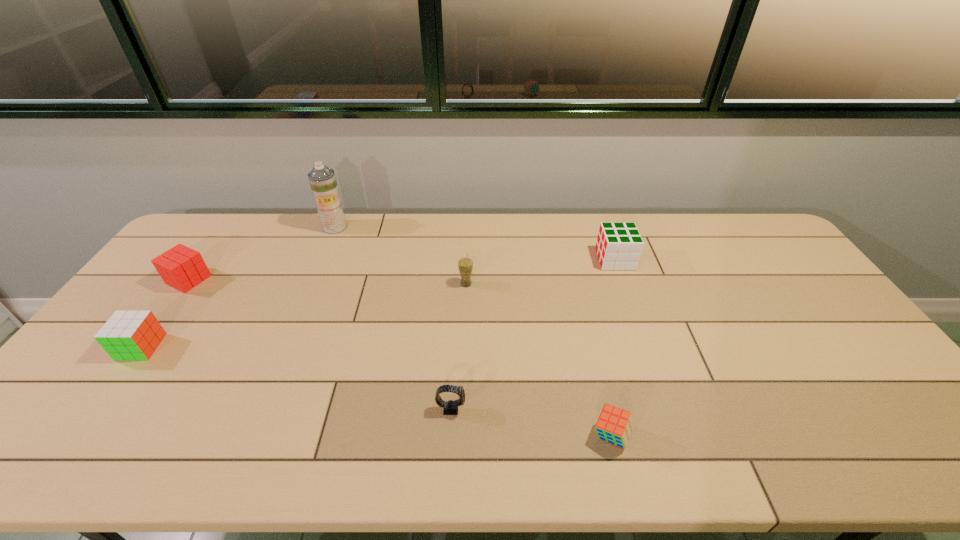
Identify the location of free space at the far edge of the desktop. This screenshot has width=960, height=540. (661, 225).

Where is `vacant space at the near edge of the desktop`? Image resolution: width=960 pixels, height=540 pixels. vacant space at the near edge of the desktop is located at coordinates (811, 435).

Find the location of `free space at the left edge of the desktop`. free space at the left edge of the desktop is located at coordinates (163, 315).

Image resolution: width=960 pixels, height=540 pixels. Find the location of `vacant region at the right edge of the desktop`. vacant region at the right edge of the desktop is located at coordinates (840, 320).

This screenshot has width=960, height=540. Find the location of `vacant space at the far right corner of the desktop`. vacant space at the far right corner of the desktop is located at coordinates (731, 221).

The height and width of the screenshot is (540, 960). Find the location of `free space between the third cube from left to right and the rightmost cube`. free space between the third cube from left to right and the rightmost cube is located at coordinates (613, 348).

In order to click on vacant space that is in between the sixth farthest object and the fifth farthest object in this screenshot , I will do `click(296, 377)`.

Find the location of a particular element. vacant region between the second nearest object and the nearest cube is located at coordinates (531, 422).

Find the location of a particular element. free space between the third farthest cube and the second object from right to left is located at coordinates (376, 391).

Image resolution: width=960 pixels, height=540 pixels. Identify the location of vacant point located between the sixth farthest object and the fifth object from right to left. (393, 318).